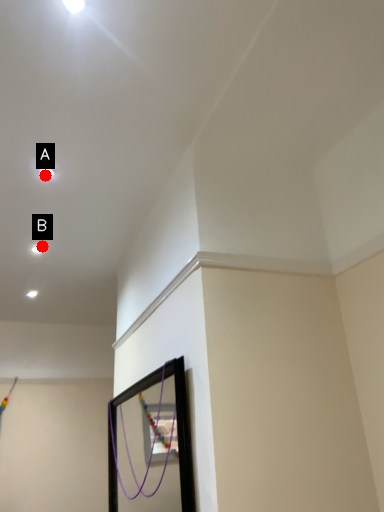
Question: Two points are circled on the image, labeled by A and B beside each circle. Which point appears closest to the camera in this image?

Choices:
 (A) A is closer
 (B) B is closer

Answer: (A)